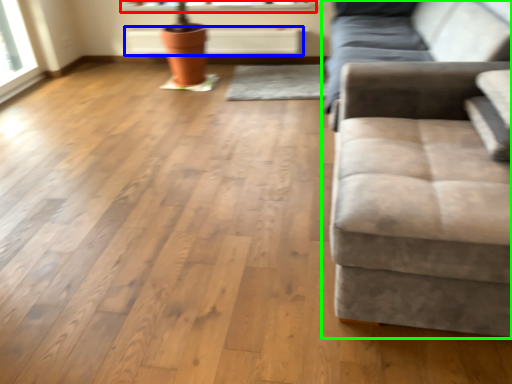
Question: Estimate the real-world distances between objects in this image. Which object is farther from window sill (highlighted by a red box), radiator (highlighted by a blue box) or studio couch (highlighted by a green box)?

Choices:
 (A) radiator
 (B) studio couch

Answer: (B)